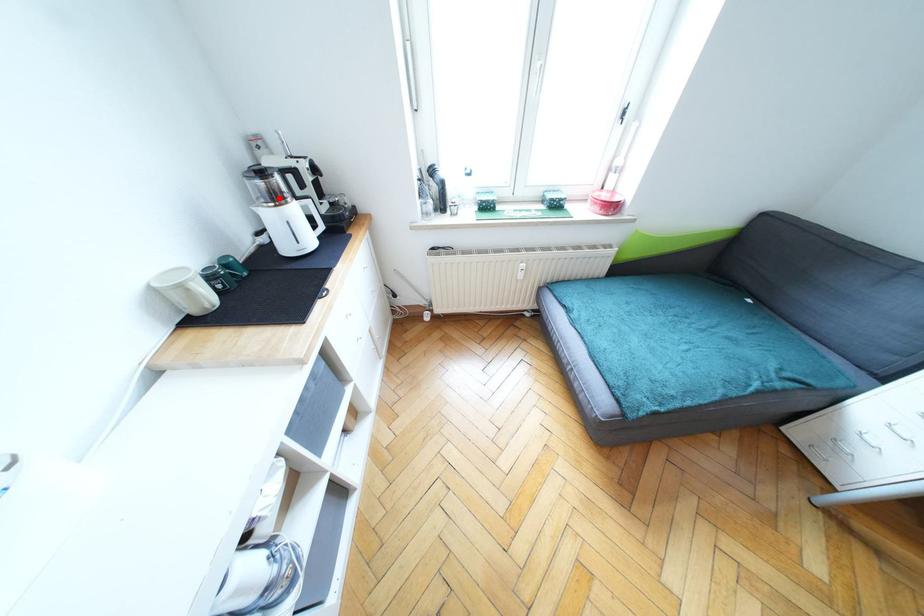
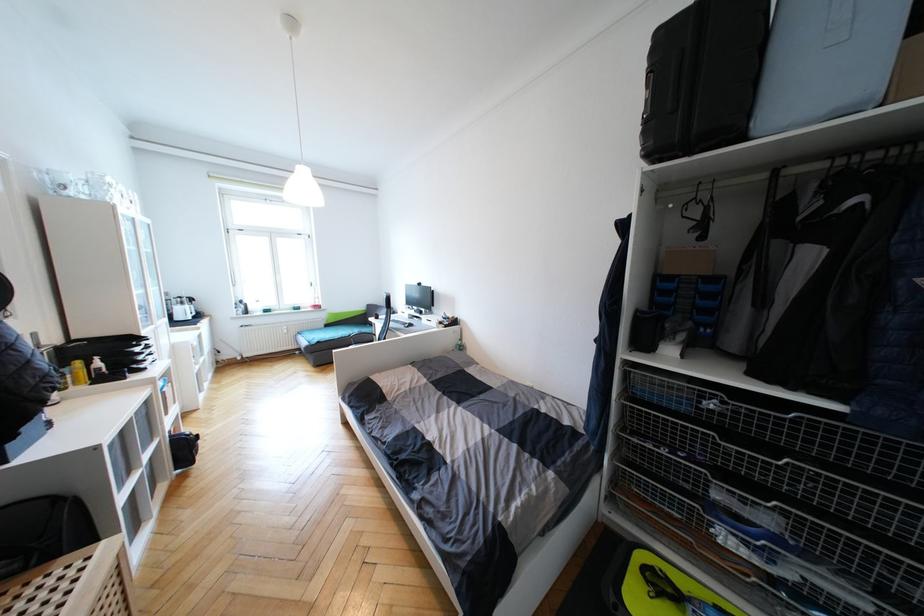
Question: I am providing you with two images of the same scene from different viewpoints. A red point is marked on the first image. Can you still see the location of the red point in image 2?

Choices:
 (A) Yes
 (B) No

Answer: (A)